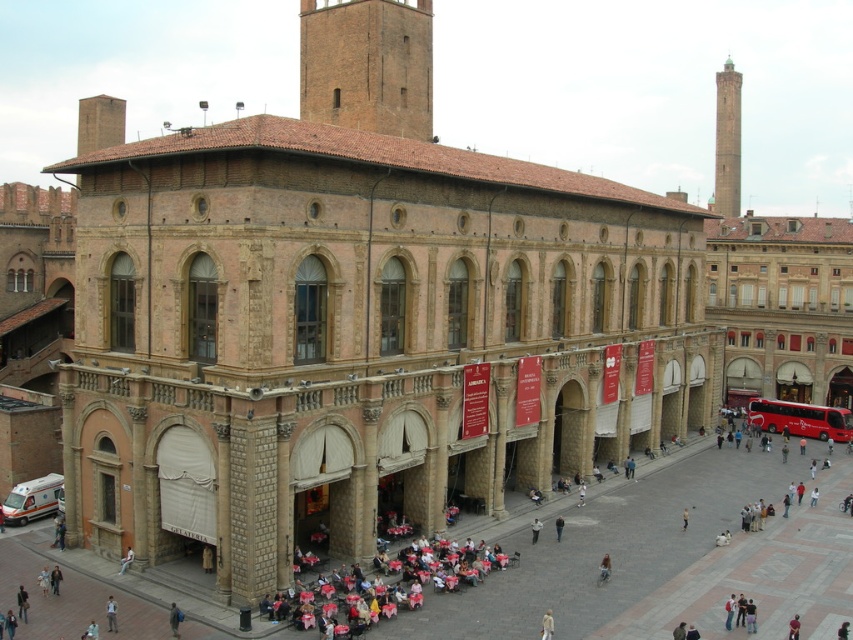
You are standing in the square and see the red metallic bus at lower right and the light blue denim jacket at lower center. Which object is positioned more to the right side of the square?

The red metallic bus at lower right is positioned more to the right side of the square than the light blue denim jacket at lower center.

You are standing in the square and see the smooth stone tower at upper right and the light blue denim jacket at lower center. Which object is positioned higher in the image?

The smooth stone tower at upper right is positioned higher in the image than the light blue denim jacket at lower center.